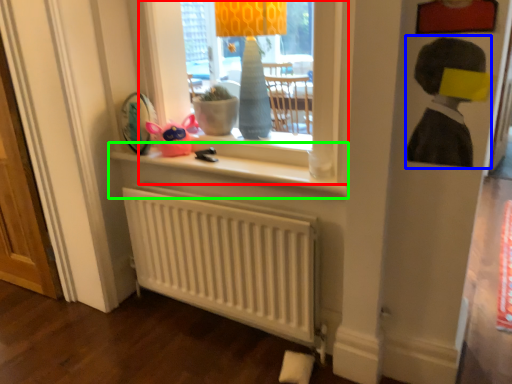
Question: Considering the real-world distances, which object is closest to window (highlighted by a red box)? person (highlighted by a blue box) or window sill (highlighted by a green box).

Choices:
 (A) person
 (B) window sill

Answer: (A)